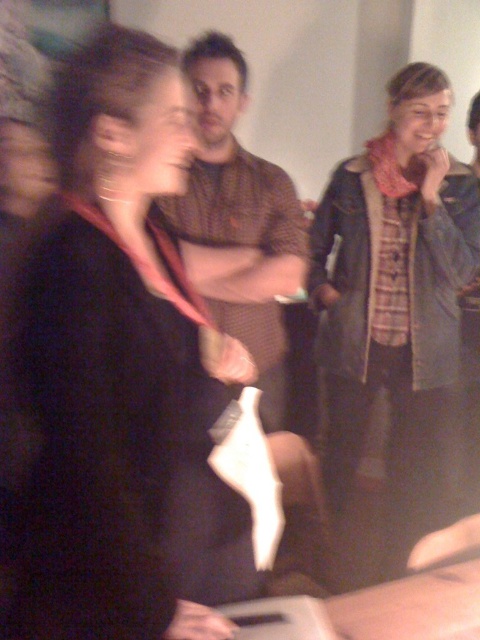
Question: Which point is farther from the camera taking this photo?

Choices:
 (A) (8, 321)
 (B) (197, 227)

Answer: (B)

Question: Considering the relative positions of plaid fabric scarf at upper right and brown textured shirt at center in the image provided, where is plaid fabric scarf at upper right located with respect to brown textured shirt at center?

Choices:
 (A) below
 (B) above

Answer: (A)

Question: Estimate the real-world distances between objects in this image. Which object is farther from the matte black scarf at center?

Choices:
 (A) brown textured shirt at center
 (B) plaid fabric scarf at upper right

Answer: (B)

Question: Among these points, which one is nearest to the camera?

Choices:
 (A) (217, 577)
 (B) (384, 208)
 (C) (266, 352)

Answer: (A)

Question: Is matte black scarf at center further to the viewer compared to plaid fabric scarf at upper right?

Choices:
 (A) no
 (B) yes

Answer: (A)

Question: Does plaid fabric scarf at upper right appear on the right side of brown textured shirt at center?

Choices:
 (A) yes
 (B) no

Answer: (A)